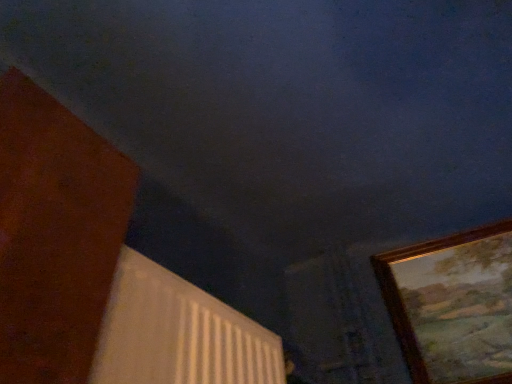
This screenshot has width=512, height=384. I want to click on white textured radiator at lower center, so click(178, 333).

What do you see at coordinates (178, 333) in the screenshot? The height and width of the screenshot is (384, 512). I see `white textured radiator at lower center` at bounding box center [178, 333].

The width and height of the screenshot is (512, 384). Describe the element at coordinates (453, 305) in the screenshot. I see `gold-framed painting at right` at that location.

What is the approximate height of gold-framed painting at right?

The height of gold-framed painting at right is 19.69 inches.

Locate an element on the screen. gold-framed painting at right is located at coordinates (453, 305).

Where is `white textured radiator at lower center`? This screenshot has width=512, height=384. white textured radiator at lower center is located at coordinates (178, 333).

Is gold-framed painting at right at the left side of white textured radiator at lower center?

In fact, gold-framed painting at right is to the right of white textured radiator at lower center.

Between gold-framed painting at right and white textured radiator at lower center, which one is positioned in front?

white textured radiator at lower center.

Is point (477, 247) more distant than point (124, 263)?

That is True.

From the image's perspective, between gold-framed painting at right and white textured radiator at lower center, which one is located above?

gold-framed painting at right, from the image's perspective.

From a real-world perspective, which object stands above the other?

gold-framed painting at right is physically above.

Considering the sizes of objects gold-framed painting at right and white textured radiator at lower center in the image provided, who is wider, gold-framed painting at right or white textured radiator at lower center?

Wider between the two is white textured radiator at lower center.

Is gold-framed painting at right shorter than white textured radiator at lower center?

No, gold-framed painting at right is not shorter than white textured radiator at lower center.

Between gold-framed painting at right and white textured radiator at lower center, which one has larger size?

Bigger between the two is white textured radiator at lower center.

Is gold-framed painting at right inside or outside of white textured radiator at lower center?

gold-framed painting at right lies outside white textured radiator at lower center.

Is gold-framed painting at right far away from white textured radiator at lower center?

That's not correct — gold-framed painting at right is a little close to white textured radiator at lower center.

Is gold-framed painting at right aimed at white textured radiator at lower center?

No, gold-framed painting at right is not turned towards white textured radiator at lower center.

Locate an element on the screen. picture frame that appears on the right of white textured radiator at lower center is located at coordinates (453, 305).

From the picture: Considering the positions of objects white textured radiator at lower center and gold-framed painting at right in the image provided, who is more to the right, white textured radiator at lower center or gold-framed painting at right?

From the viewer's perspective, gold-framed painting at right appears more on the right side.

Which is in front, white textured radiator at lower center or gold-framed painting at right?

white textured radiator at lower center.

Is point (158, 341) closer or farther from the camera than point (456, 282)?

Point (158, 341) is positioned closer to the camera compared to point (456, 282).

From the image's perspective, between white textured radiator at lower center and gold-framed painting at right, which one is located above?

gold-framed painting at right.

From a real-world perspective, is white textured radiator at lower center positioned over gold-framed painting at right based on gravity?

No, from a real-world perspective, white textured radiator at lower center is not on top of gold-framed painting at right.

Considering the sizes of white textured radiator at lower center and gold-framed painting at right in the image, is white textured radiator at lower center wider or thinner than gold-framed painting at right?

Clearly, white textured radiator at lower center has more width compared to gold-framed painting at right.

Considering the sizes of objects white textured radiator at lower center and gold-framed painting at right in the image provided, who is taller, white textured radiator at lower center or gold-framed painting at right?

gold-framed painting at right is taller.

Can you confirm if white textured radiator at lower center is smaller than gold-framed painting at right?

No, white textured radiator at lower center is not smaller than gold-framed painting at right.

Is white textured radiator at lower center inside the boundaries of gold-framed painting at right, or outside?

white textured radiator at lower center lies outside gold-framed painting at right.

Based on the photo, is white textured radiator at lower center far from gold-framed painting at right?

No, white textured radiator at lower center is not far away from gold-framed painting at right.

Is gold-framed painting at right at the back of white textured radiator at lower center?

No, white textured radiator at lower center's orientation is not away from gold-framed painting at right.

From the picture: What's the angular difference between white textured radiator at lower center and gold-framed painting at right's facing directions?

The angular difference between white textured radiator at lower center and gold-framed painting at right is 68.1 degrees.

Image resolution: width=512 pixels, height=384 pixels. Identify the location of radiator beneath the gold-framed painting at right (from a real-world perspective). click(178, 333).

You are a GUI agent. You are given a task and a screenshot of the screen. Output one action in this format:
    pyautogui.click(x=<x>, y=<y>)
    Task: Click on the picture frame located above the white textured radiator at lower center (from a real-world perspective)
    The width and height of the screenshot is (512, 384).
    Given the screenshot: What is the action you would take?
    pyautogui.click(x=453, y=305)

Identify the location of radiator below the gold-framed painting at right (from a real-world perspective). This screenshot has height=384, width=512. (178, 333).